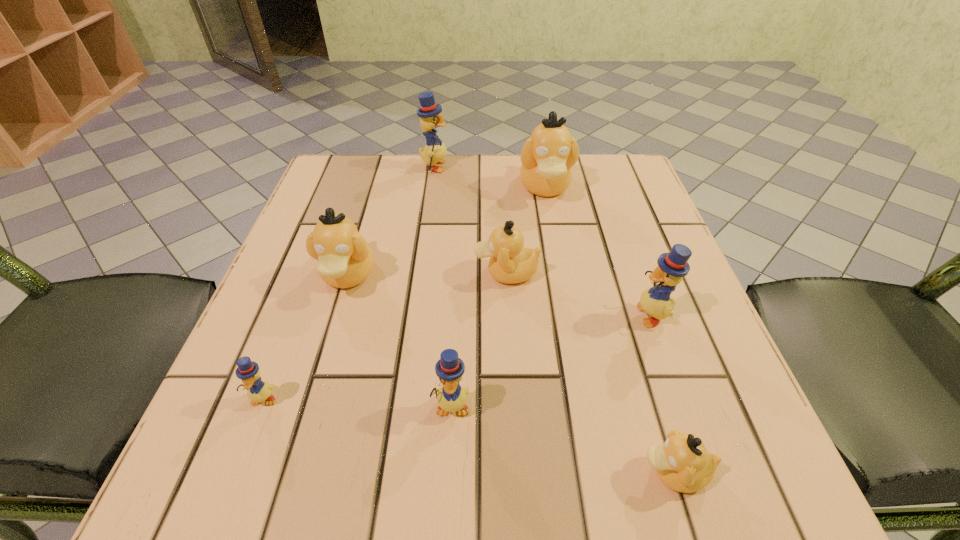
The width and height of the screenshot is (960, 540). I want to click on tan duckling that is the third nearest to the biggest tan duckling, so click(682, 463).

Select which tan duckling appears as the fourth closest to the leftmost yellow duckling. Please provide its 2D coordinates. Your answer should be formatted as a tuple, i.e. [(x, y)], where the tuple contains the x and y coordinates of a point satisfying the conditions above.

[(547, 156)]

Find the location of a particular element. vacant space that satisfies the following two spatial constraints: 1. on the face of the second farthest yellow duckling, where the monocle is placed; 2. on the face of the leftmost yellow duckling, where the monocle is placed is located at coordinates (682, 399).